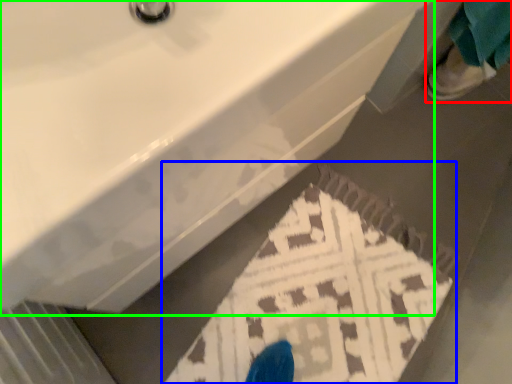
Question: Based on their relative distances, which object is nearer to person (highlighted by a red box)? Choose from doormat (highlighted by a blue box) and sink (highlighted by a green box).

Choices:
 (A) doormat
 (B) sink

Answer: (A)